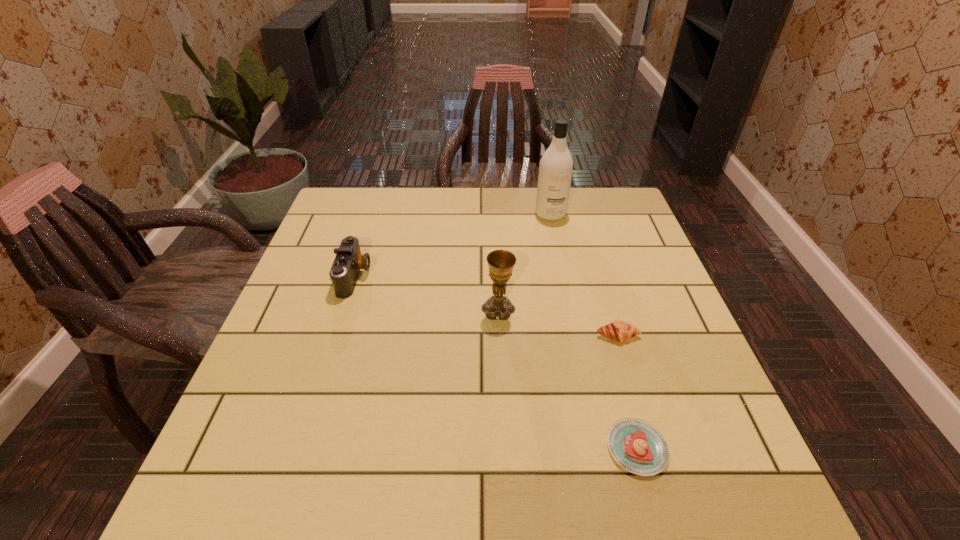
Locate an element on the screen. blank region between the farthest object and the farther pastry is located at coordinates (585, 275).

Image resolution: width=960 pixels, height=540 pixels. Identify the location of free space between the fourth farthest object and the shorter pastry. (628, 393).

Find the location of `free space between the farther pastry and the shorter pastry`. free space between the farther pastry and the shorter pastry is located at coordinates (628, 393).

What are the coordinates of `vacant space that's between the second object from left to right and the nearer pastry` in the screenshot? It's located at (567, 379).

This screenshot has height=540, width=960. Find the location of `the fourth closest object to the farthest object`. the fourth closest object to the farthest object is located at coordinates (638, 447).

Choose which object is the fourth nearest neighbor to the nearer pastry. Please provide its 2D coordinates. Your answer should be formatted as a tuple, i.e. [(x, y)], where the tuple contains the x and y coordinates of a point satisfying the conditions above.

[(555, 172)]

Find the location of `free spot that satisfies the following two spatial constraints: 1. on the lens of the leftmost object; 2. on the left side of the fourth shortest object`. free spot that satisfies the following two spatial constraints: 1. on the lens of the leftmost object; 2. on the left side of the fourth shortest object is located at coordinates tap(345, 309).

At what (x,y) coordinates should I click in order to perform the action: click on vacant space that satisfies the following two spatial constraints: 1. on the back side of the chalice; 2. on the lens of the camera. Please return your answer as a coordinate pair (x, y). Looking at the image, I should click on (497, 276).